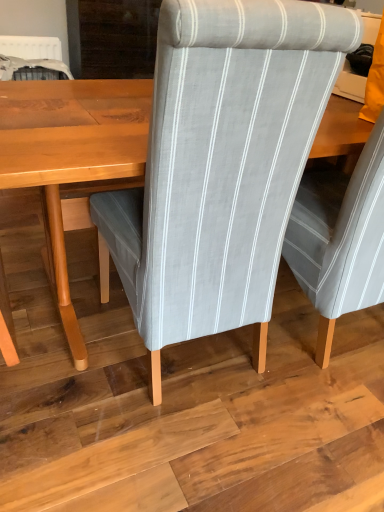
I want to click on vacant space underneath light gray fabric chair at center (from a real-world perspective), so click(185, 356).